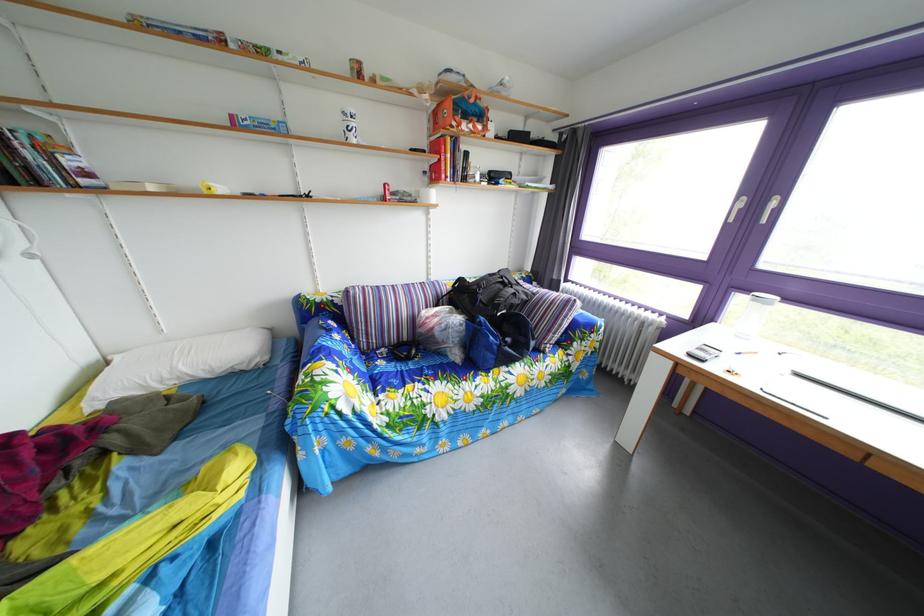
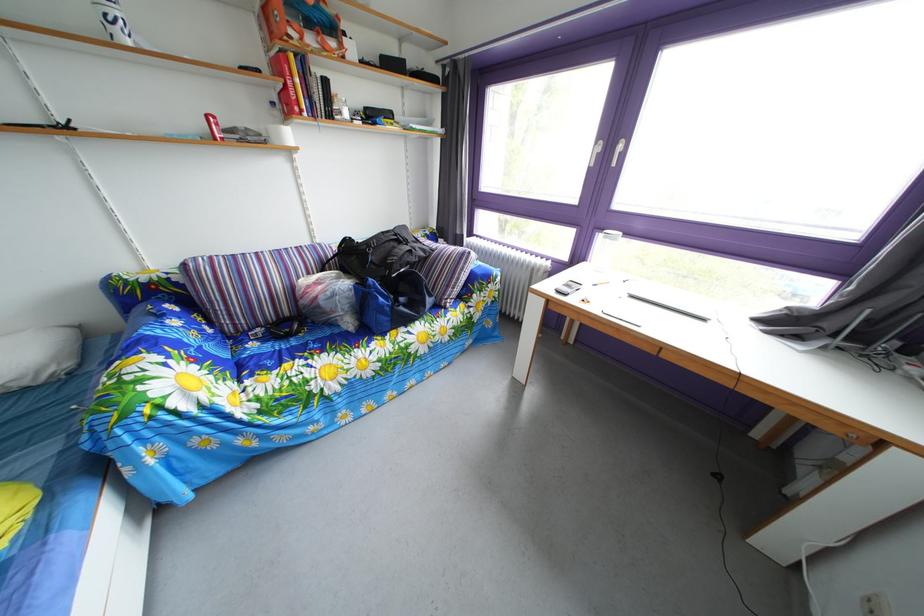
Find the pixel in the second image that matches (x=476, y=124) in the first image.

(320, 33)